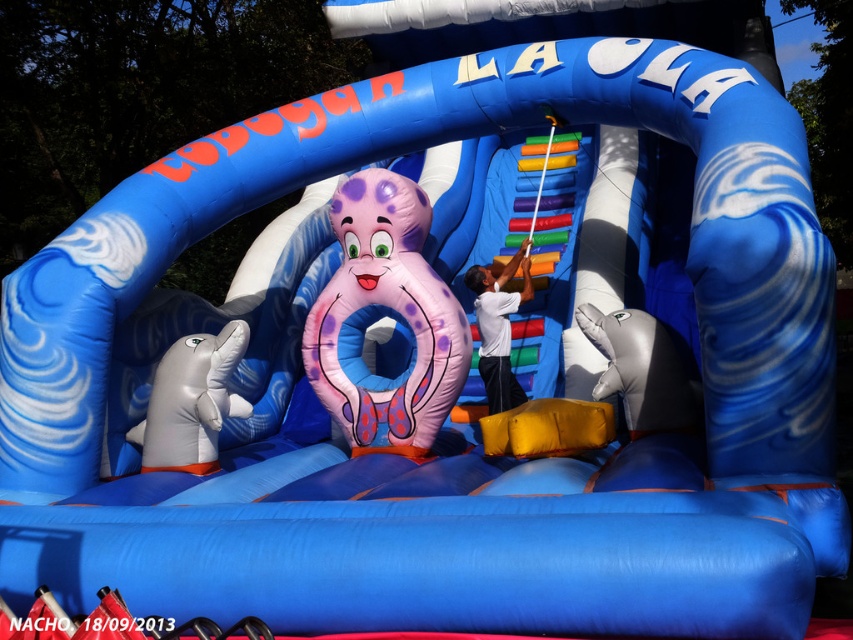
You are a parent trying to ensure your child can safely play on the bouncy castle. The child is wearing a white smooth shirt at center and wants to reach the white rubber dolphin at lower left. Given that the child can stretch 2 meters, can they reach the dolphin without moving?

The white rubber dolphin at lower left is 2.54 meters away from the white smooth shirt at center. Since the child can only stretch 2 meters, they cannot reach the dolphin without moving.

You are a child standing at the entrance of the bouncy castle and want to find the pink rubber octopus at center. Which direction should you move from the white rubber dolphin at lower left to locate it?

The pink rubber octopus at center is to the right of the white rubber dolphin at lower left, so you should move to the right to locate it.